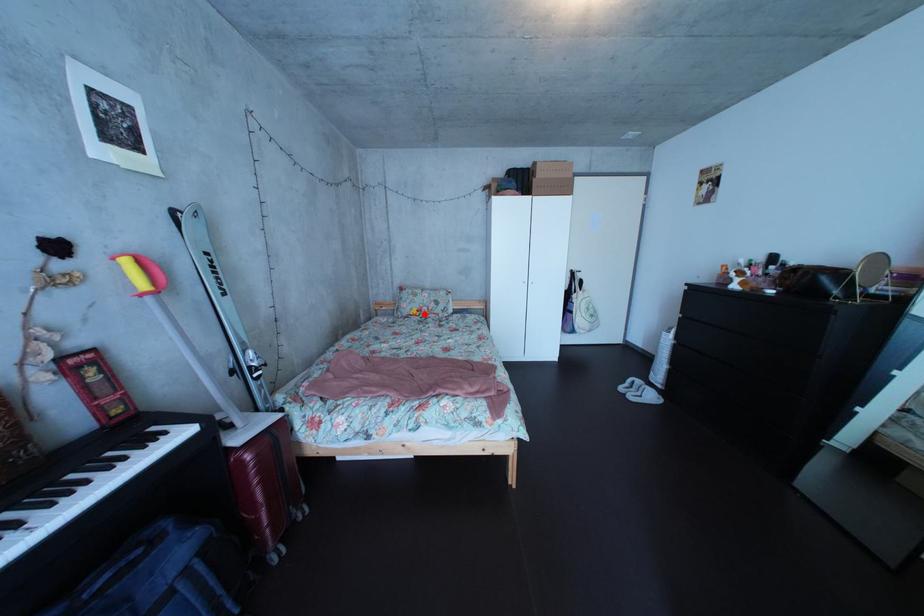
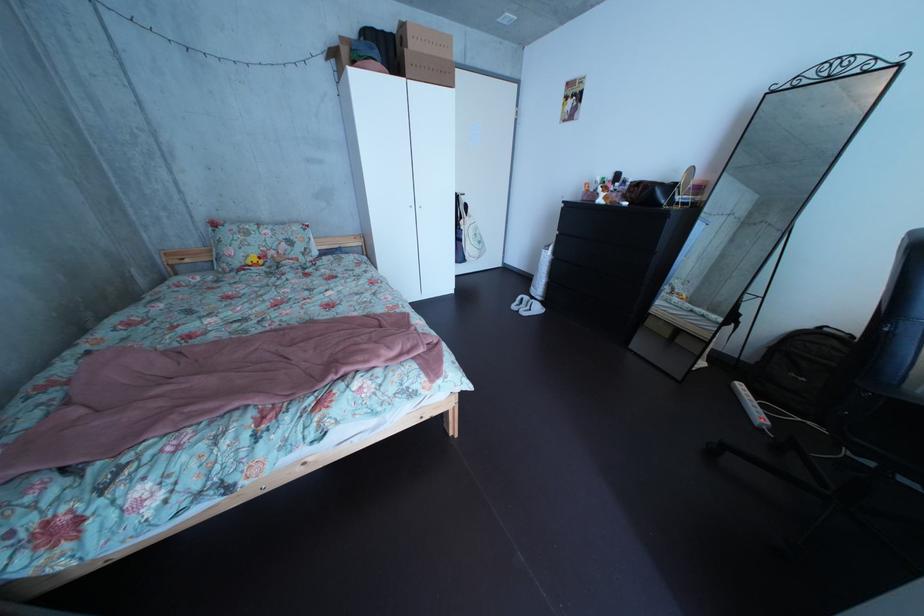
Question: I am providing you with two images of the same scene from different viewpoints. A red point is shown in image1. For the corresponding object point in image2, is it positioned nearer or farther from the camera?

Choices:
 (A) Nearer
 (B) Farther

Answer: (A)